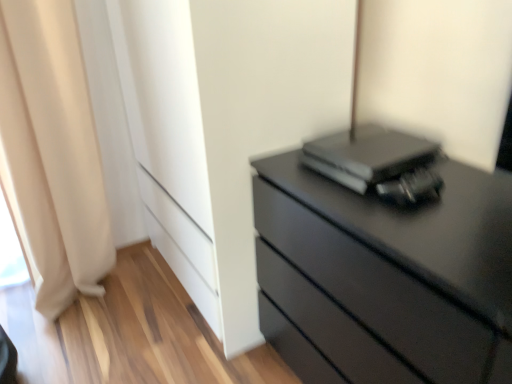
Question: Visually, is beige fabric curtain at left positioned to the left or to the right of black matte computer at upper right?

Choices:
 (A) right
 (B) left

Answer: (B)

Question: In the image, is beige fabric curtain at left positioned in front of or behind black matte computer at upper right?

Choices:
 (A) behind
 (B) front

Answer: (A)

Question: Which object is the farthest from the beige fabric curtain at left?

Choices:
 (A) matte black chest of drawers at right
 (B) black matte computer at upper right

Answer: (A)

Question: Which object is positioned closest to the beige fabric curtain at left?

Choices:
 (A) black matte computer at upper right
 (B) matte black chest of drawers at right

Answer: (A)